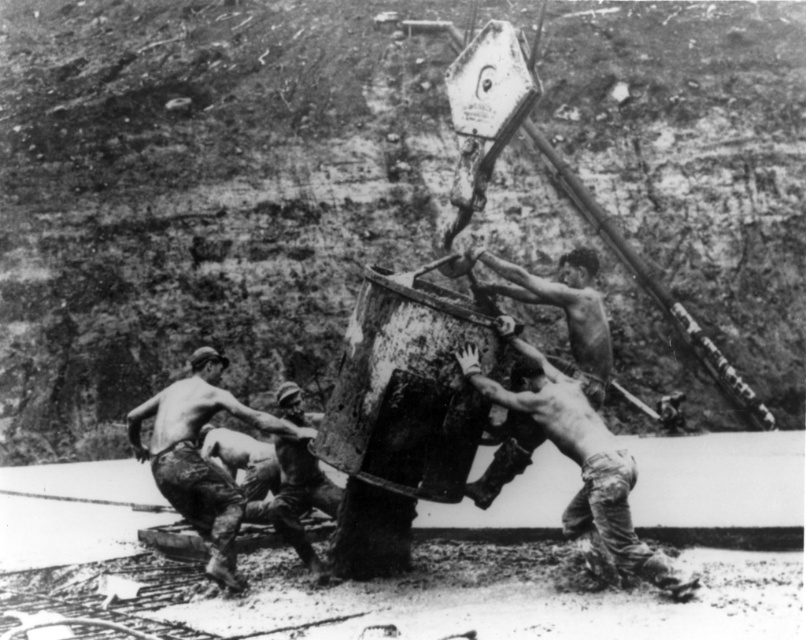
Does dirty skin man at center appear on the left side of shiny metal chain at center?

Yes, dirty skin man at center is to the left of shiny metal chain at center.

Does dirty skin man at center appear on the right side of shiny metal chain at center?

No, dirty skin man at center is not to the right of shiny metal chain at center.

Is point (629, 512) positioned after point (576, 300)?

That is False.

Where is `dirty skin man at center`? The image size is (806, 640). dirty skin man at center is located at coordinates (580, 465).

Can you confirm if shiny metal chain at center is thinner than camouflage fabric pants at lower center?

In fact, shiny metal chain at center might be wider than camouflage fabric pants at lower center.

Does shiny metal chain at center have a smaller size compared to camouflage fabric pants at lower center?

No.

Locate an element on the screen. The height and width of the screenshot is (640, 806). shiny metal chain at center is located at coordinates (564, 308).

Describe the element at coordinates (580, 465) in the screenshot. I see `dirty skin man at center` at that location.

Does dirty skin man at center lie behind camouflage fabric pants at center?

No.

Locate an element on the screen. dirty skin man at center is located at coordinates (580, 465).

This screenshot has width=806, height=640. In order to click on dirty skin man at center in this screenshot , I will do `click(580, 465)`.